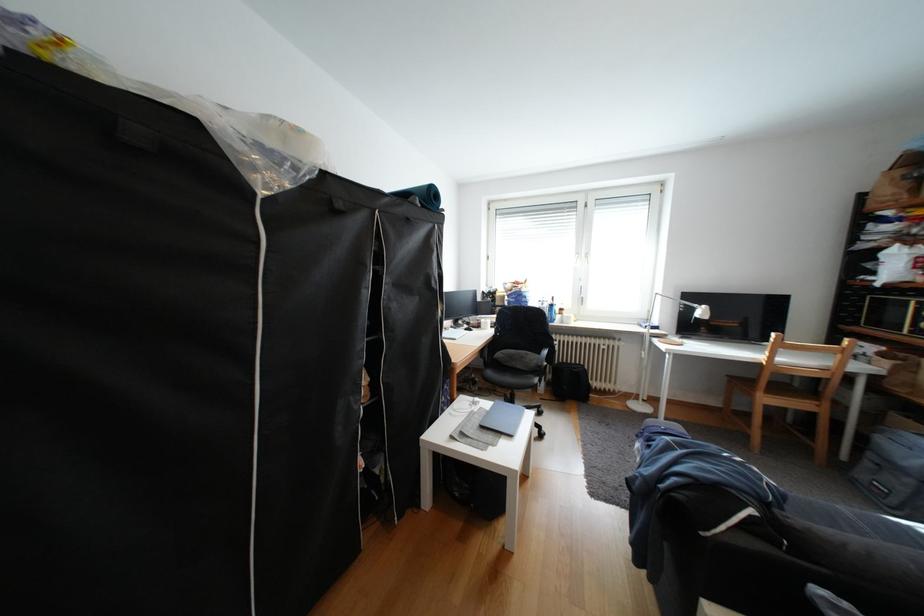
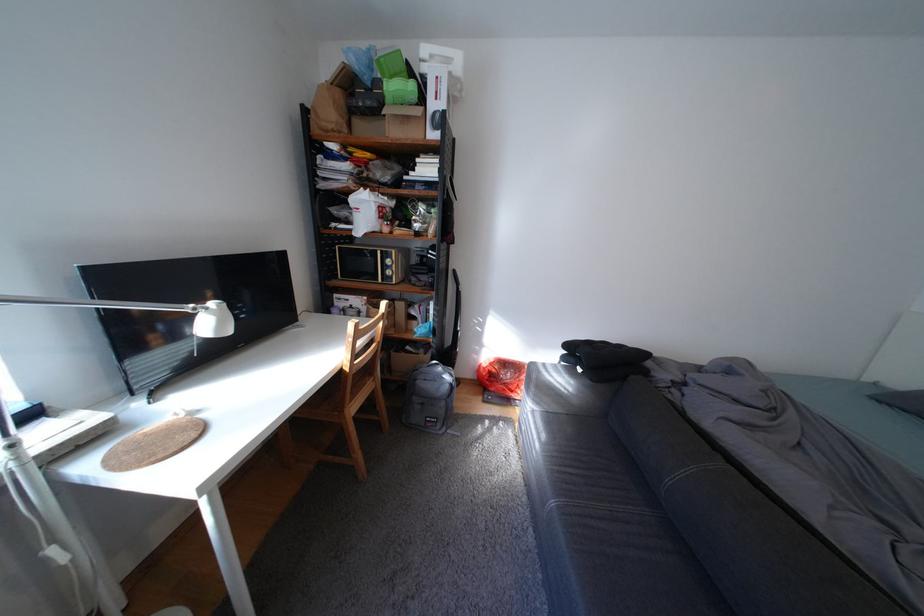
Where in the second image is the point corresponding to point 716,307 from the first image?

(225, 305)